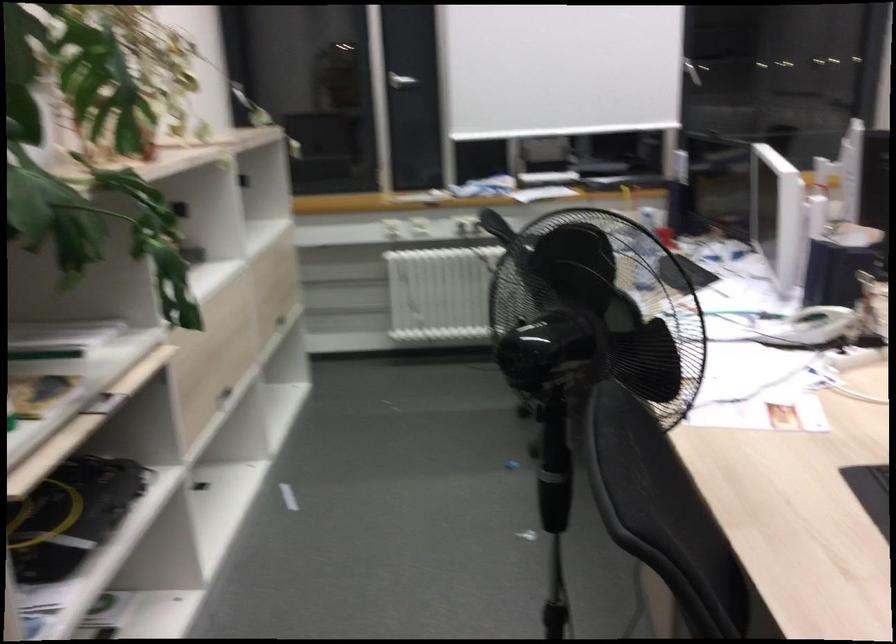
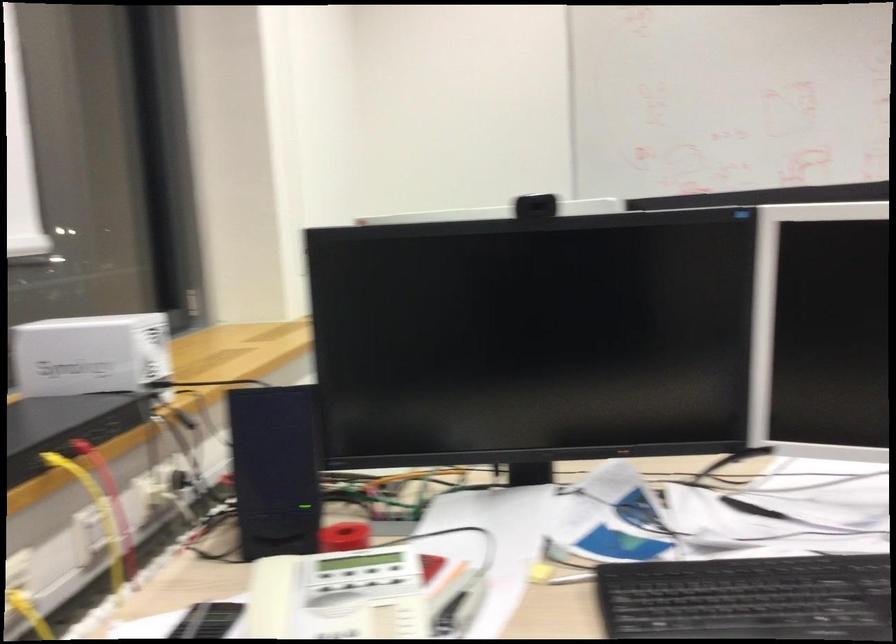
Where in the second image is the point corresponding to (x=667, y=205) from the first image?

(274, 469)